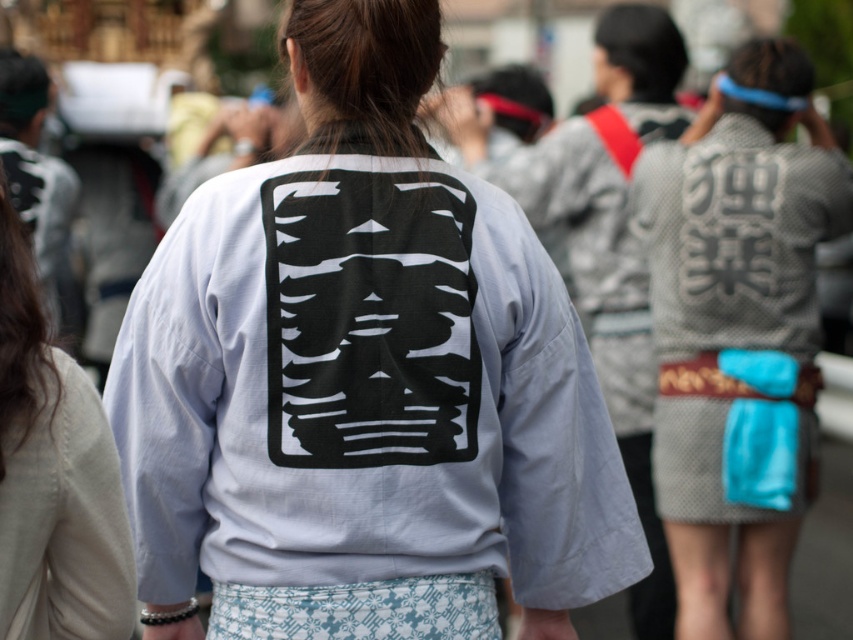
Question: Which point is closer to the camera taking this photo?

Choices:
 (A) (33, 547)
 (B) (252, 260)

Answer: (A)

Question: Can you confirm if white cotton kimono at center is thinner than light gray cotton kimono at center?

Choices:
 (A) yes
 (B) no

Answer: (B)

Question: Does white textured kimono at center appear on the right side of light gray cotton kimono at center?

Choices:
 (A) no
 (B) yes

Answer: (B)

Question: Which point is farther to the camera?

Choices:
 (A) white cotton kimono at center
 (B) light gray cotton kimono at center

Answer: (A)

Question: Estimate the real-world distances between objects in this image. Which object is farther from the light gray cotton kimono at center?

Choices:
 (A) white textured kimono at center
 (B) white cotton kimono at center

Answer: (A)

Question: Is white cotton kimono at center further to camera compared to white textured kimono at center?

Choices:
 (A) yes
 (B) no

Answer: (B)